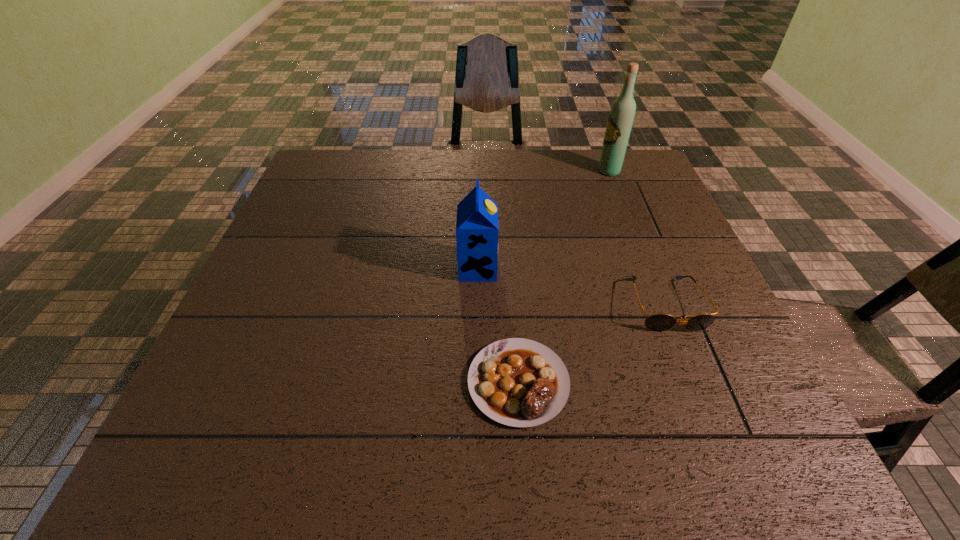
I want to click on unoccupied position between the shortest object and the third shortest object, so click(x=498, y=325).

Locate an element on the screen. This screenshot has height=540, width=960. free space between the second shortest object and the carton is located at coordinates (571, 287).

Where is `object that is the closest to the steak`? This screenshot has width=960, height=540. object that is the closest to the steak is located at coordinates (656, 322).

I want to click on object that ranks as the third closest to the sunglasses, so click(x=621, y=116).

I want to click on vacant region that satisfies the following two spatial constraints: 1. with the cap open on the third shortest object; 2. on the right side of the shortest object, so click(x=477, y=382).

Locate an element on the screen. The image size is (960, 540). vacant space that satisfies the following two spatial constraints: 1. with the cap open on the second tallest object; 2. on the right side of the shortest object is located at coordinates (477, 382).

Locate an element on the screen. The width and height of the screenshot is (960, 540). free space that satisfies the following two spatial constraints: 1. with the cap open on the carton; 2. on the left side of the nearest object is located at coordinates (477, 382).

This screenshot has width=960, height=540. What are the coordinates of `vacant space that satisfies the following two spatial constraints: 1. with the cap open on the second tallest object; 2. on the right side of the nearest object` in the screenshot? It's located at (477, 382).

This screenshot has width=960, height=540. Find the location of `free location that satisfies the following two spatial constraints: 1. with the cap open on the nearest object; 2. on the left side of the carton`. free location that satisfies the following two spatial constraints: 1. with the cap open on the nearest object; 2. on the left side of the carton is located at coordinates (477, 382).

Identify the location of vacant area in the image that satisfies the following two spatial constraints: 1. with the cap open on the third shortest object; 2. on the back side of the nearest object. The height and width of the screenshot is (540, 960). (477, 382).